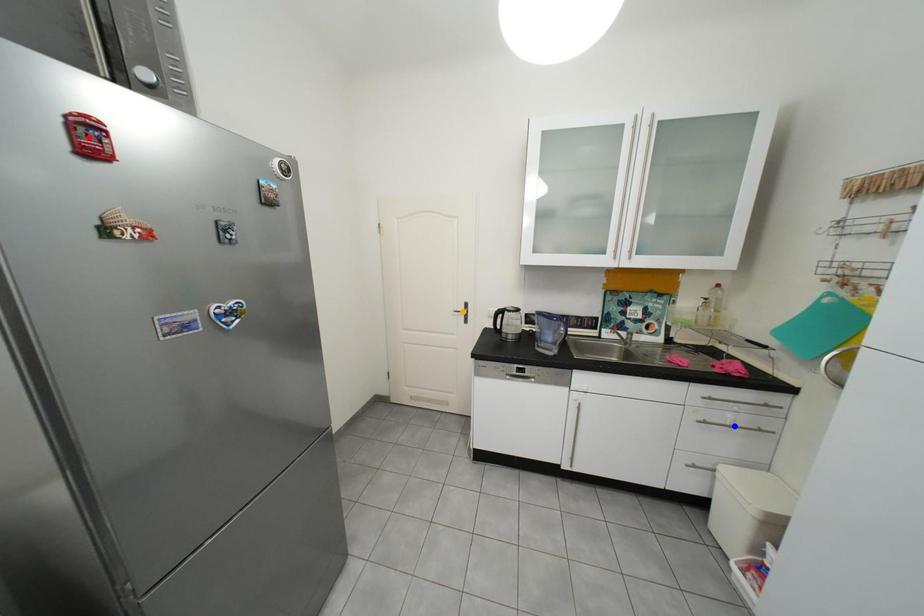
Order these from nearest to farthest:
orange point, blue point, red point

red point → blue point → orange point